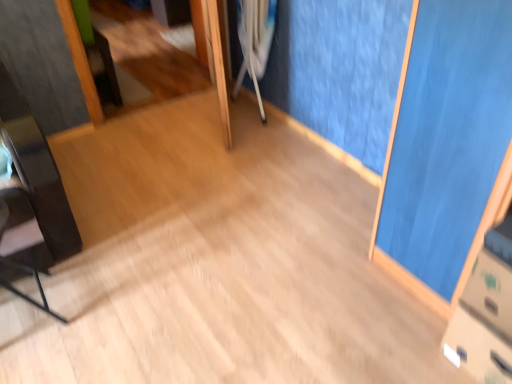
The height and width of the screenshot is (384, 512). What do you see at coordinates (26, 295) in the screenshot? I see `matte black chair at left` at bounding box center [26, 295].

What is the approximate width of matte black chair at left?

It is 11.08 inches.

In the scene shown: Measure the distance between point (27,269) and camera.

They are 5.63 feet apart.

Identify the location of matte black chair at left. (26, 295).

In the scene shown: In order to face white plastic crutch at center, should I rotate leftwards or rightwards?

Turn left approximately 0.636 degrees to face it.

Describe the element at coordinates (255, 41) in the screenshot. The image size is (512, 384). I see `white plastic crutch at center` at that location.

You are a GUI agent. You are given a task and a screenshot of the screen. Output one action in this format:
    pyautogui.click(x=<x>, y=<y>)
    Task: Click on the white plastic crutch at center
    The width and height of the screenshot is (512, 384).
    Given the screenshot: What is the action you would take?
    pyautogui.click(x=255, y=41)

Image resolution: width=512 pixels, height=384 pixels. Find the location of `matte black chair at left`. matte black chair at left is located at coordinates (26, 295).

Considering the positions of objects matte black chair at left and white plastic crutch at center in the image provided, who is more to the left, matte black chair at left or white plastic crutch at center?

Positioned to the left is matte black chair at left.

Considering the relative positions of matte black chair at left and white plastic crutch at center in the image provided, is matte black chair at left in front of white plastic crutch at center?

Yes, it is.

Between point (10, 261) and point (242, 73), which one is positioned in front?

The point (10, 261) is closer.

From the picture: From the image's perspective, is matte black chair at left above or below white plastic crutch at center?

matte black chair at left is situated lower than white plastic crutch at center in the image.

From a real-world perspective, which object stands above the other?

white plastic crutch at center.

Consider the image. Is matte black chair at left wider than white plastic crutch at center?

Yes, matte black chair at left is wider than white plastic crutch at center.

Which of these two, matte black chair at left or white plastic crutch at center, stands taller?

white plastic crutch at center is taller.

Consider the image. Which of these two, matte black chair at left or white plastic crutch at center, is smaller?

matte black chair at left is smaller.

Would you say white plastic crutch at center is part of matte black chair at left's contents?

Actually, white plastic crutch at center is outside matte black chair at left.

Are matte black chair at left and white plastic crutch at center beside each other?

matte black chair at left and white plastic crutch at center are clearly separated.

Could you tell me if matte black chair at left is turned towards white plastic crutch at center?

No, matte black chair at left is not turned towards white plastic crutch at center.

How distant is matte black chair at left from white plastic crutch at center?

matte black chair at left and white plastic crutch at center are 5.11 feet apart.

Locate an element on the screen. The width and height of the screenshot is (512, 384). chair below the white plastic crutch at center (from the image's perspective) is located at coordinates (26, 295).

Does white plastic crutch at center appear on the left side of matte black chair at left?

No.

Is white plastic crutch at center in front of or behind matte black chair at left in the image?

In the image, white plastic crutch at center appears behind matte black chair at left.

Does point (250, 22) come in front of point (6, 260)?

No, (250, 22) is further to viewer.

From the image's perspective, is white plastic crutch at center above or below matte black chair at left?

Clearly, from the image's perspective, white plastic crutch at center is above matte black chair at left.

From a real-world perspective, does white plastic crutch at center stand above matte black chair at left?

Yes.

Can you confirm if white plastic crutch at center is wider than matte black chair at left?

Incorrect, the width of white plastic crutch at center does not surpass that of matte black chair at left.

From their relative heights in the image, would you say white plastic crutch at center is taller or shorter than matte black chair at left?

Clearly, white plastic crutch at center is taller compared to matte black chair at left.

Which of these two, white plastic crutch at center or matte black chair at left, is smaller?

Smaller between the two is matte black chair at left.

Would you say white plastic crutch at center contains matte black chair at left?

→ No.

Is white plastic crutch at center with matte black chair at left?

white plastic crutch at center and matte black chair at left are clearly separated.

Is white plastic crutch at center oriented towards matte black chair at left?

No, white plastic crutch at center is not oriented towards matte black chair at left.

Can you tell me how much white plastic crutch at center and matte black chair at left differ in facing direction?

The angular difference between white plastic crutch at center and matte black chair at left is 92.9 degrees.

How distant is white plastic crutch at center from matte black chair at left?

5.11 feet.

Where is `crutch above the matte black chair at left (from the image's perspective)`? The image size is (512, 384). crutch above the matte black chair at left (from the image's perspective) is located at coordinates (255, 41).

What are the coordinates of `chair below the white plastic crutch at center (from the image's perspective)` in the screenshot? It's located at (26, 295).

This screenshot has width=512, height=384. Identify the location of crutch on the right of matte black chair at left. (255, 41).